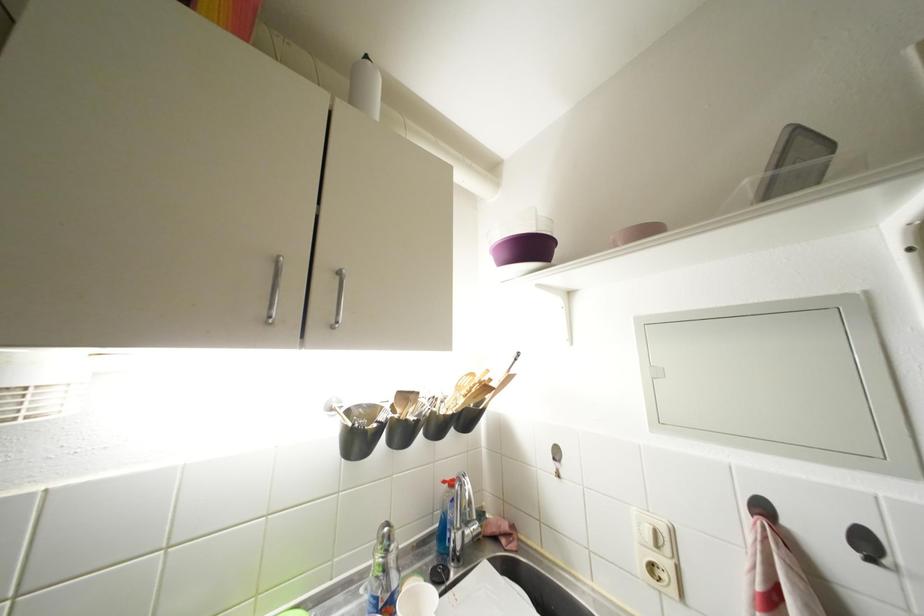
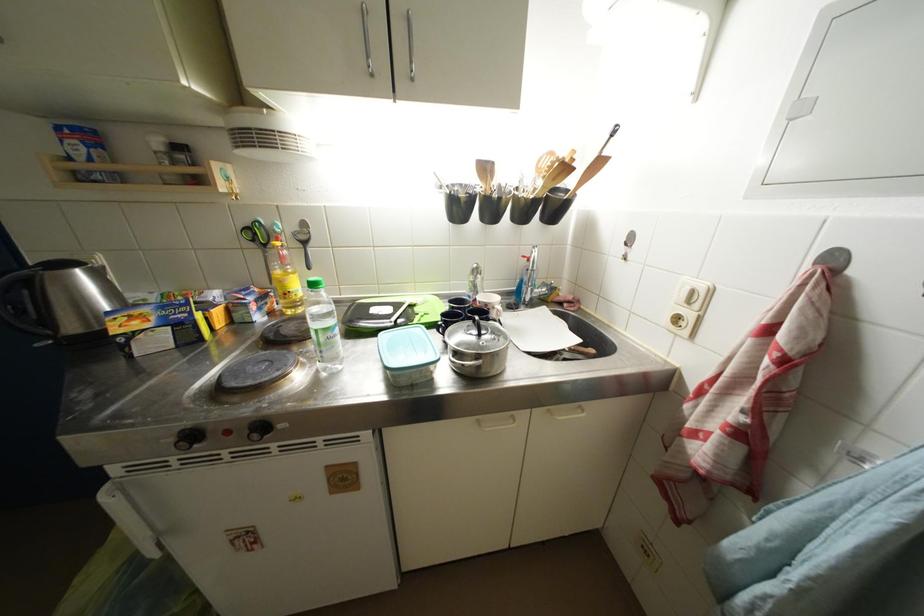
Locate, in the second image, the point that corresponds to the point at 663,549 in the first image.

(696, 306)